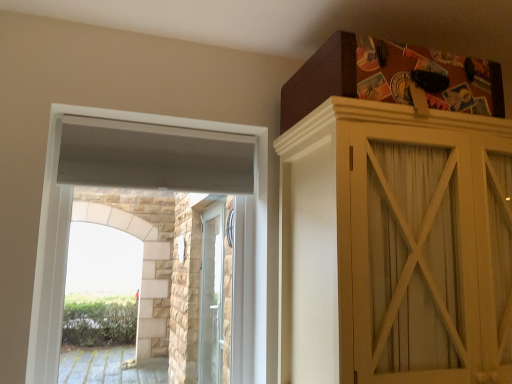
Question: Is matte wooden cupboard at upper right not inside white textured window at upper left?

Choices:
 (A) yes
 (B) no

Answer: (A)

Question: Is matte wooden cupboard at upper right shorter than white textured window at upper left?

Choices:
 (A) no
 (B) yes

Answer: (B)

Question: Considering the relative positions of matte wooden cupboard at upper right and white textured window at upper left in the image provided, is matte wooden cupboard at upper right in front of white textured window at upper left?

Choices:
 (A) no
 (B) yes

Answer: (B)

Question: Does matte wooden cupboard at upper right have a lesser width compared to white textured window at upper left?

Choices:
 (A) yes
 (B) no

Answer: (B)

Question: From the image's perspective, is matte wooden cupboard at upper right located above white textured window at upper left?

Choices:
 (A) yes
 (B) no

Answer: (B)

Question: Is matte wooden cupboard at upper right facing towards white textured window at upper left?

Choices:
 (A) yes
 (B) no

Answer: (B)

Question: Is matte wooden cupboard at upper right located within white textured window at upper left?

Choices:
 (A) no
 (B) yes

Answer: (A)

Question: Is white textured window at upper left positioned before matte wooden cupboard at upper right?

Choices:
 (A) no
 (B) yes

Answer: (A)

Question: Does white textured window at upper left touch matte wooden cupboard at upper right?

Choices:
 (A) yes
 (B) no

Answer: (B)

Question: Considering the relative sizes of white textured window at upper left and matte wooden cupboard at upper right in the image provided, is white textured window at upper left smaller than matte wooden cupboard at upper right?

Choices:
 (A) yes
 (B) no

Answer: (A)

Question: From a real-world perspective, is white textured window at upper left over matte wooden cupboard at upper right?

Choices:
 (A) no
 (B) yes

Answer: (B)

Question: Is white textured window at upper left not close to matte wooden cupboard at upper right?

Choices:
 (A) yes
 (B) no

Answer: (B)

Question: From a real-world perspective, is white textured window at upper left physically located above or below matte wooden cupboard at upper right?

Choices:
 (A) below
 (B) above

Answer: (B)